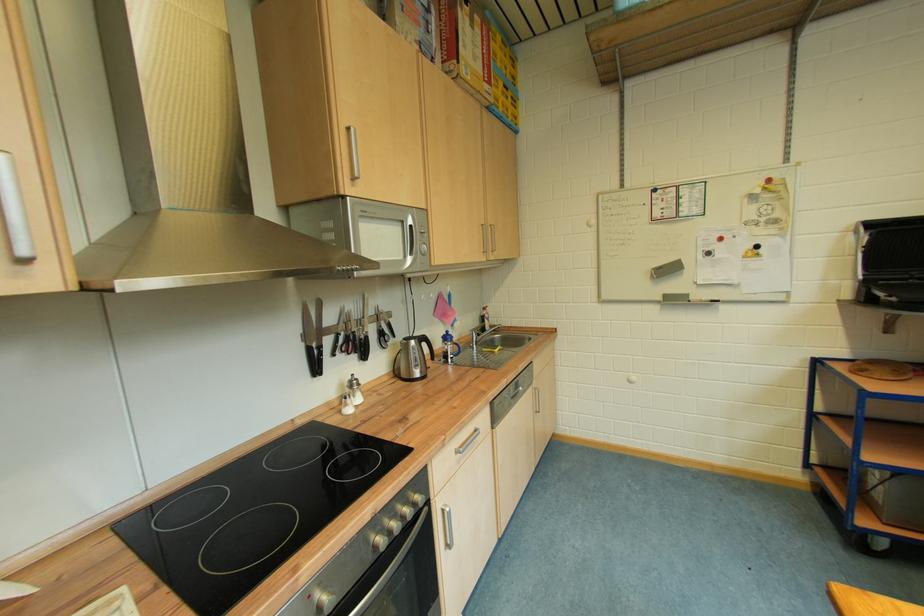
Where would you grasp the black marker? Please return your answer as a coordinate pair (x, y).

(309, 339)